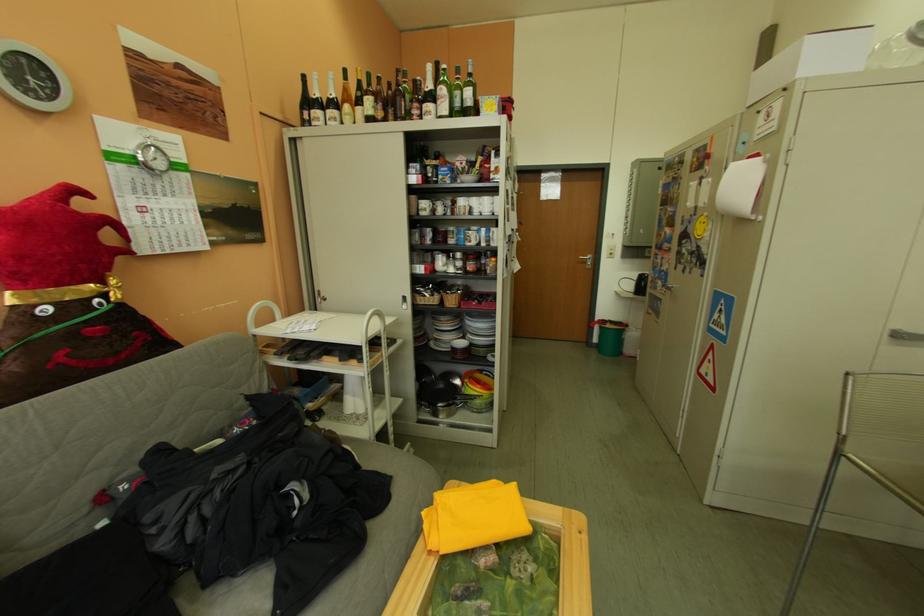
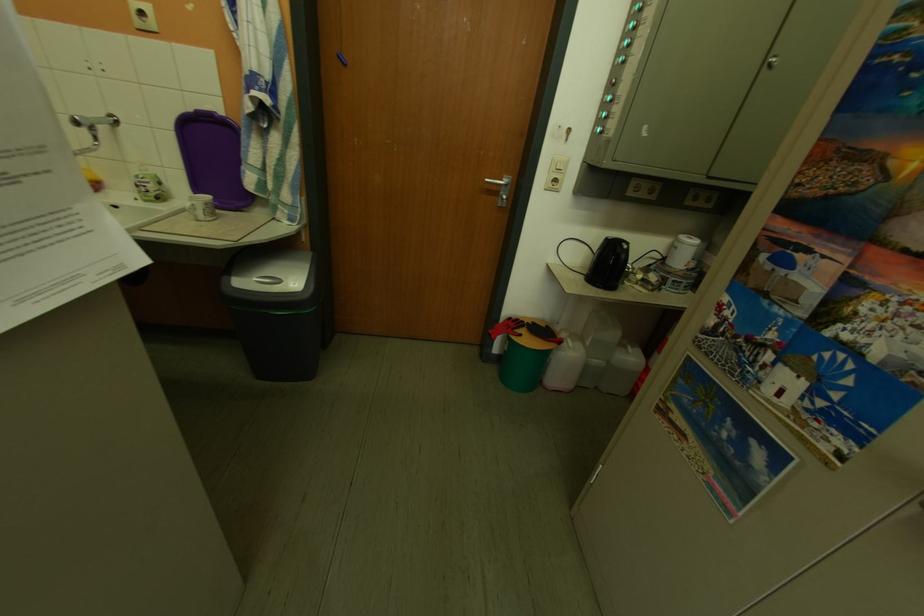
Find the pixel in the second image that matches [638,329] in the first image.

(574, 345)